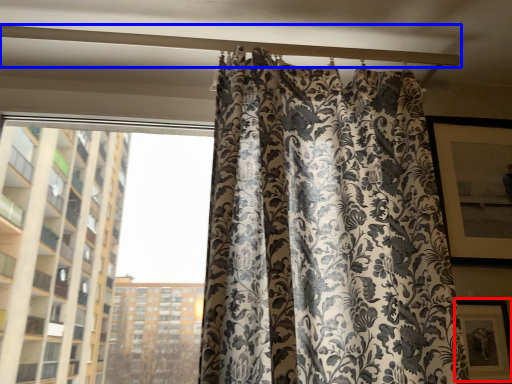
Question: Which object is further to the camera taking this photo, picture frame (highlighted by a red box) or beam (highlighted by a blue box)?

Choices:
 (A) picture frame
 (B) beam

Answer: (B)